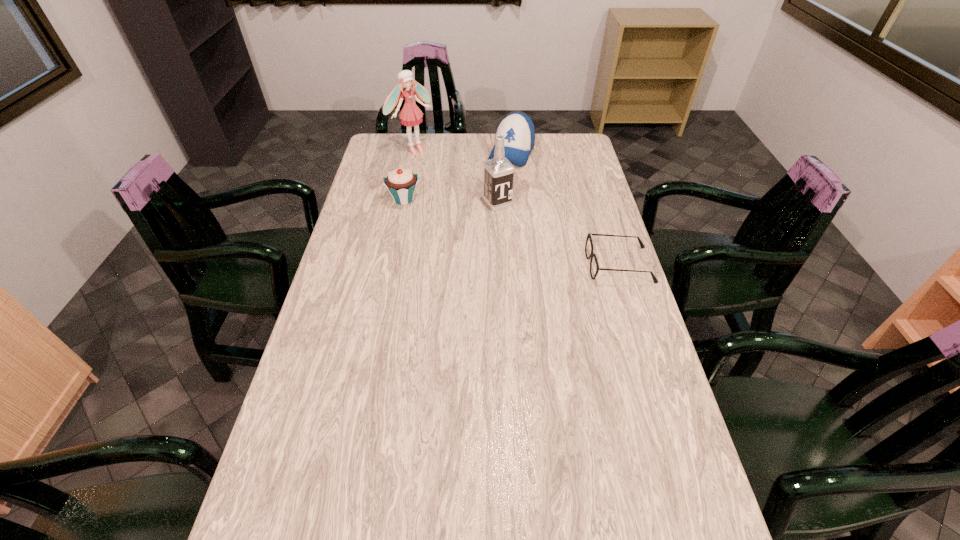
Find the location of `cupcake`. cupcake is located at coordinates (401, 183).

This screenshot has height=540, width=960. In order to click on the rightmost object in this screenshot , I will do `click(589, 235)`.

The image size is (960, 540). Find the location of `the nearest object`. the nearest object is located at coordinates (589, 235).

Identify the location of doll. The height and width of the screenshot is (540, 960). (411, 115).

This screenshot has height=540, width=960. In order to click on baseball cap in this screenshot , I will do `click(518, 129)`.

Locate an element on the screen. the fourth shortest object is located at coordinates (498, 172).

Where is `vacant space located on the back of the cupcake`? vacant space located on the back of the cupcake is located at coordinates (415, 144).

Find the location of `vacant space located 0.240m on the front-facing side of the doll`. vacant space located 0.240m on the front-facing side of the doll is located at coordinates (454, 184).

At what (x,y) coordinates should I click in order to perform the action: click on vacant region located 0.340m on the front-facing side of the doll. Please return your answer as a coordinate pair (x, y). Image resolution: width=960 pixels, height=540 pixels. Looking at the image, I should click on (468, 196).

You are a GUI agent. You are given a task and a screenshot of the screen. Output one action in this format:
    pyautogui.click(x=<x>, y=<y>)
    Task: Click on the vacant space located 0.390m on the front-facing side of the doll
    
    Given the screenshot: What is the action you would take?
    pyautogui.click(x=475, y=203)